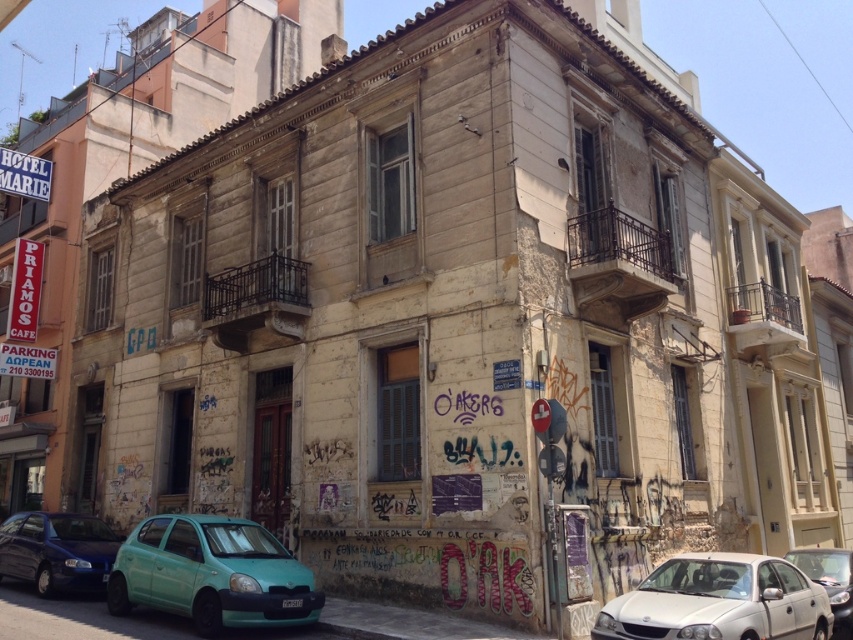
Question: Is teal matte hatchback at lower left to the right of white matte sedan at lower right from the viewer's perspective?

Choices:
 (A) no
 (B) yes

Answer: (A)

Question: Which point is farther to the camera?

Choices:
 (A) teal matte hatchback at lower left
 (B) matte blue sedan at lower left

Answer: (B)

Question: Based on their relative distances, which object is nearer to the metallic silver sedan at lower right?

Choices:
 (A) teal matte hatchback at lower left
 (B) matte blue sedan at lower left
 (C) white matte sedan at lower right

Answer: (C)

Question: Is teal matte hatchback at lower left to the right of white matte sedan at lower right from the viewer's perspective?

Choices:
 (A) no
 (B) yes

Answer: (A)

Question: Which object is closer to the camera taking this photo?

Choices:
 (A) matte blue sedan at lower left
 (B) metallic silver sedan at lower right
 (C) white matte sedan at lower right
 (D) teal matte hatchback at lower left

Answer: (C)

Question: From the image, what is the correct spatial relationship of white matte sedan at lower right in relation to metallic silver sedan at lower right?

Choices:
 (A) right
 (B) left

Answer: (B)